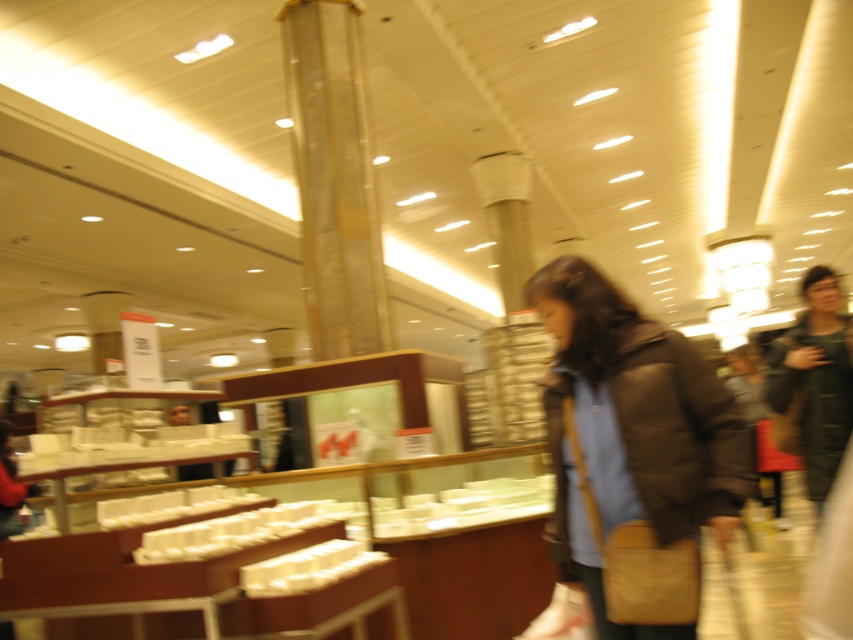
You are a customer in the store and want to try on both the matte black jacket at center and the dark brown leather jacket at right. Which jacket should you pick up first if you want to start with the one closer to the left side of the store?

You should pick up the matte black jacket at center first because it is positioned on the left side of the dark brown leather jacket at right, making it closer to the left side of the store.

You are a customer in the store and want to reach the matte black jacket at center. The store has a rule that you must stay at least 1 meter away from the ceiling columns. Given that the columns are located at points between 0.6 and 0.7 on the x and y axes, can you safely approach the jacket without violating the store rules?

The matte black jacket at center is located at point (646,444). The columns are between 0.6 and 0.7 on both axes. Since the jacket is at 0.695 and 0.758, it is outside the column area, so you can approach safely without violating the 1 meter rule.